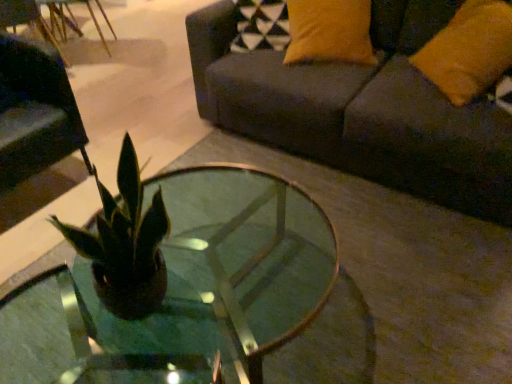
Locate an element on the screen. This screenshot has width=512, height=384. matte black swivel chair at left is located at coordinates tap(34, 111).

What do you see at coordinates (469, 50) in the screenshot? The height and width of the screenshot is (384, 512). I see `orange fabric pillow at upper right` at bounding box center [469, 50].

What do you see at coordinates (195, 285) in the screenshot? I see `clear glass coffee table at center` at bounding box center [195, 285].

Find the location of a particular element. dark gray fabric couch at upper right is located at coordinates 360,109.

Is the surface of matte black swivel chair at left in direct contact with dark gray fabric couch at upper right?

matte black swivel chair at left is not next to dark gray fabric couch at upper right, and they're not touching.

Can you confirm if matte black swivel chair at left is positioned to the right of dark gray fabric couch at upper right?

Incorrect, matte black swivel chair at left is not on the right side of dark gray fabric couch at upper right.

In the scene shown: Is matte black swivel chair at left aimed at dark gray fabric couch at upper right?

No, matte black swivel chair at left is not turned towards dark gray fabric couch at upper right.

How many degrees apart are the facing directions of matte black swivel chair at left and dark gray fabric couch at upper right?

There is a 88.6-degree angle between the facing directions of matte black swivel chair at left and dark gray fabric couch at upper right.

Relative to clear glass coffee table at center, is dark gray fabric couch at upper right in front or behind?

Result: dark gray fabric couch at upper right is positioned farther from the viewer than clear glass coffee table at center.

From the image's perspective, who appears lower, dark gray fabric couch at upper right or clear glass coffee table at center?

From the image's view, clear glass coffee table at center is below.

Considering the sizes of objects dark gray fabric couch at upper right and clear glass coffee table at center in the image provided, who is taller, dark gray fabric couch at upper right or clear glass coffee table at center?

dark gray fabric couch at upper right is taller.

Is dark gray fabric couch at upper right positioned with its back to clear glass coffee table at center?

That's not correct — dark gray fabric couch at upper right is not looking away from clear glass coffee table at center.

Image resolution: width=512 pixels, height=384 pixels. I want to click on studio couch that is in front of the matte black swivel chair at left, so click(360, 109).

Does dark gray fabric couch at upper right have a lesser width compared to matte black swivel chair at left?

No, dark gray fabric couch at upper right is not thinner than matte black swivel chair at left.

Considering the sizes of objects dark gray fabric couch at upper right and matte black swivel chair at left in the image provided, who is shorter, dark gray fabric couch at upper right or matte black swivel chair at left?

matte black swivel chair at left is shorter.

From the image's perspective, is dark gray fabric couch at upper right under matte black swivel chair at left?

Incorrect, from the image's perspective, dark gray fabric couch at upper right is higher than matte black swivel chair at left.

Looking at their sizes, would you say clear glass coffee table at center is wider or thinner than orange fabric pillow at upper right?

clear glass coffee table at center is wider than orange fabric pillow at upper right.

Considering their positions, is clear glass coffee table at center located in front of or behind orange fabric pillow at upper right?

Clearly, clear glass coffee table at center is in front of orange fabric pillow at upper right.

Is point (305, 279) more distant than point (470, 21)?

No.

From their relative heights in the image, would you say clear glass coffee table at center is taller or shorter than orange fabric pillow at upper right?

Clearly, clear glass coffee table at center is shorter compared to orange fabric pillow at upper right.

Looking at this image, is orange fabric pillow at upper right facing towards dark gray fabric couch at upper right?

Yes, orange fabric pillow at upper right is aimed at dark gray fabric couch at upper right.

Looking at the image, does orange fabric pillow at upper right seem bigger or smaller compared to dark gray fabric couch at upper right?

Considering their sizes, orange fabric pillow at upper right takes up less space than dark gray fabric couch at upper right.

The image size is (512, 384). I want to click on pillow on the right of the dark gray fabric couch at upper right, so coord(469,50).

Is orange fabric pillow at upper right directly adjacent to dark gray fabric couch at upper right?

No, orange fabric pillow at upper right is not touching dark gray fabric couch at upper right.

Locate an element on the screen. coffee table to the right of matte black swivel chair at left is located at coordinates (195, 285).

Which is in front, point (47, 356) or point (11, 114)?

The point (47, 356) is more forward.

Is the position of clear glass coffee table at center less distant than that of matte black swivel chair at left?

Yes, it is in front of matte black swivel chair at left.

Is clear glass coffee table at center looking in the opposite direction of matte black swivel chair at left?

No, clear glass coffee table at center is not facing away from matte black swivel chair at left.

Is matte black swivel chair at left to the left of clear glass coffee table at center from the viewer's perspective?

Indeed, matte black swivel chair at left is positioned on the left side of clear glass coffee table at center.

From a real-world perspective, which object rests below the other?

clear glass coffee table at center is physically lower.

Measure the distance from matte black swivel chair at left to clear glass coffee table at center.

matte black swivel chair at left and clear glass coffee table at center are 33.21 inches apart.

Image resolution: width=512 pixels, height=384 pixels. I want to click on swivel chair below the dark gray fabric couch at upper right (from the image's perspective), so click(x=34, y=111).

At what (x,y) coordinates should I click in order to perform the action: click on studio couch on the right side of clear glass coffee table at center. Please return your answer as a coordinate pair (x, y). This screenshot has height=384, width=512. Looking at the image, I should click on (360, 109).

Considering their positions, is matte black swivel chair at left positioned further to orange fabric pillow at upper right than dark gray fabric couch at upper right?

matte black swivel chair at left is positioned further to the anchor orange fabric pillow at upper right.

Consider the image. Based on their spatial positions, is clear glass coffee table at center or orange fabric pillow at upper right closer to dark gray fabric couch at upper right?

orange fabric pillow at upper right.

In the scene shown: Based on their spatial positions, is clear glass coffee table at center or matte black swivel chair at left further from orange fabric pillow at upper right?

matte black swivel chair at left.

Estimate the real-world distances between objects in this image. Which object is closer to orange fabric pillow at upper right, clear glass coffee table at center or dark gray fabric couch at upper right?

dark gray fabric couch at upper right lies closer to orange fabric pillow at upper right than the other object.

Looking at the image, which one is located closer to clear glass coffee table at center, orange fabric pillow at upper right or matte black swivel chair at left?

matte black swivel chair at left lies closer to clear glass coffee table at center than the other object.

Based on their spatial positions, is dark gray fabric couch at upper right or orange fabric pillow at upper right further from matte black swivel chair at left?

orange fabric pillow at upper right.

Considering their positions, is dark gray fabric couch at upper right positioned further to orange fabric pillow at upper right than clear glass coffee table at center?

clear glass coffee table at center is positioned further to the anchor orange fabric pillow at upper right.

Based on their spatial positions, is matte black swivel chair at left or orange fabric pillow at upper right further from clear glass coffee table at center?

orange fabric pillow at upper right.

At what (x,y) coordinates should I click in order to perform the action: click on studio couch between matte black swivel chair at left and orange fabric pillow at upper right. Please return your answer as a coordinate pair (x, y). Looking at the image, I should click on (360, 109).

In order to click on coffee table between matte black swivel chair at left and orange fabric pillow at upper right in the horizontal direction in this screenshot , I will do `click(195, 285)`.

Identify the location of studio couch between clear glass coffee table at center and orange fabric pillow at upper right. The width and height of the screenshot is (512, 384). (360, 109).

Find the location of a particular element. The image size is (512, 384). coffee table located between matte black swivel chair at left and dark gray fabric couch at upper right in the left-right direction is located at coordinates (195, 285).